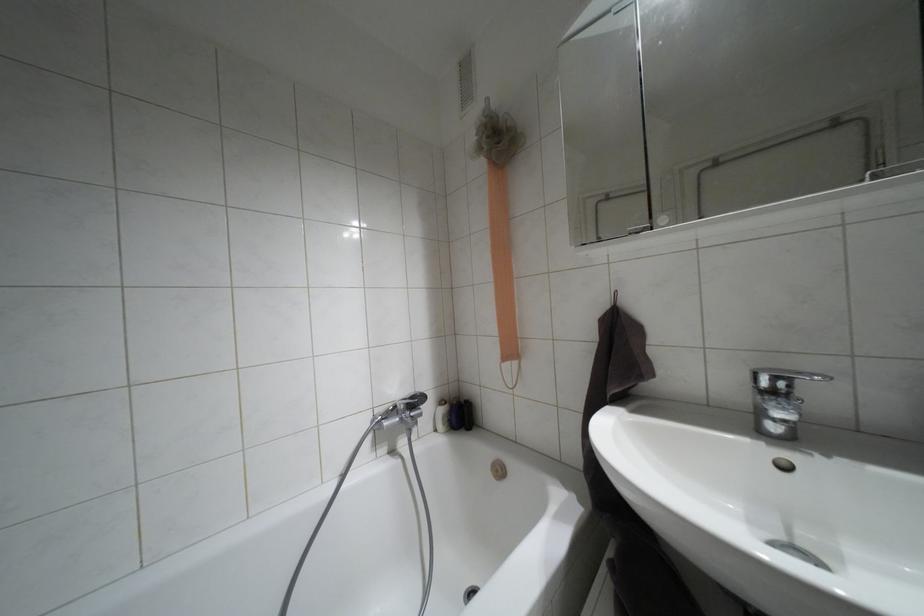
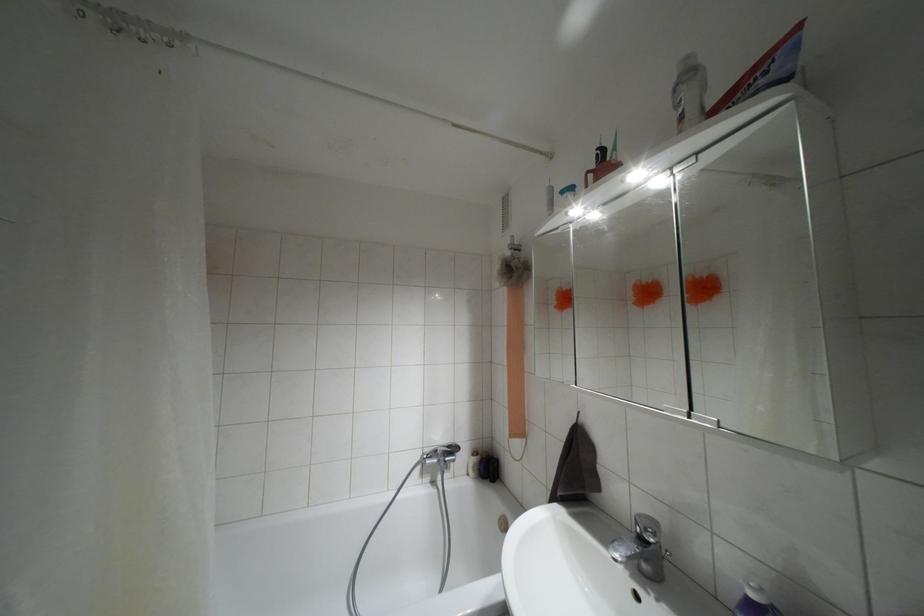
In the second image, find the point that corresponds to (x=772, y=392) in the first image.

(641, 538)